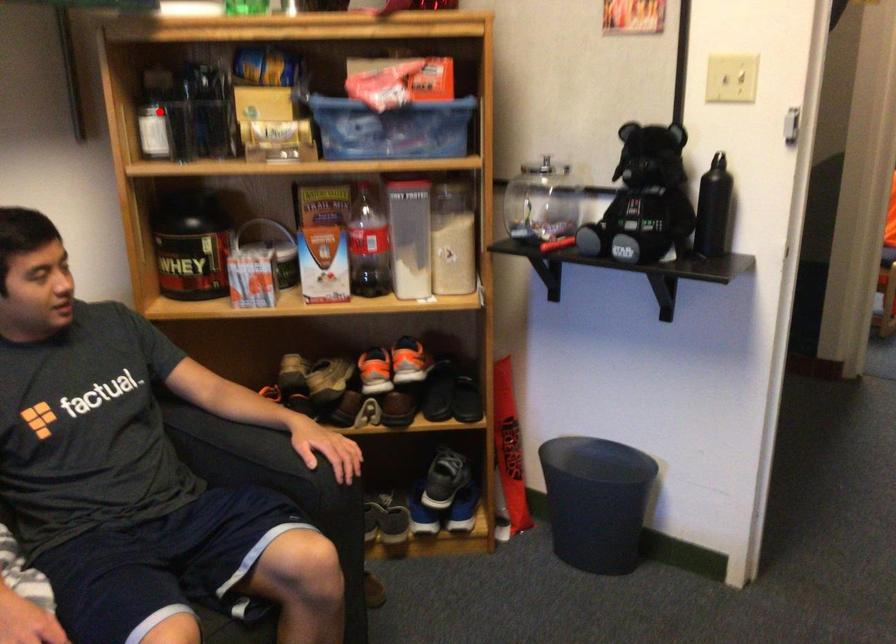
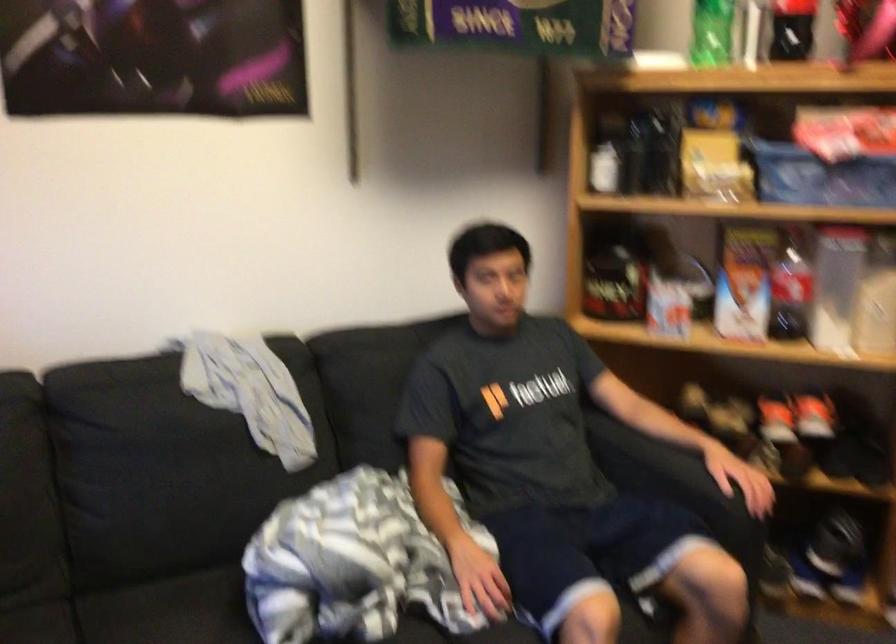
The point at the highlighted location is marked in the first image. Where is the corresponding point in the second image?

(607, 154)